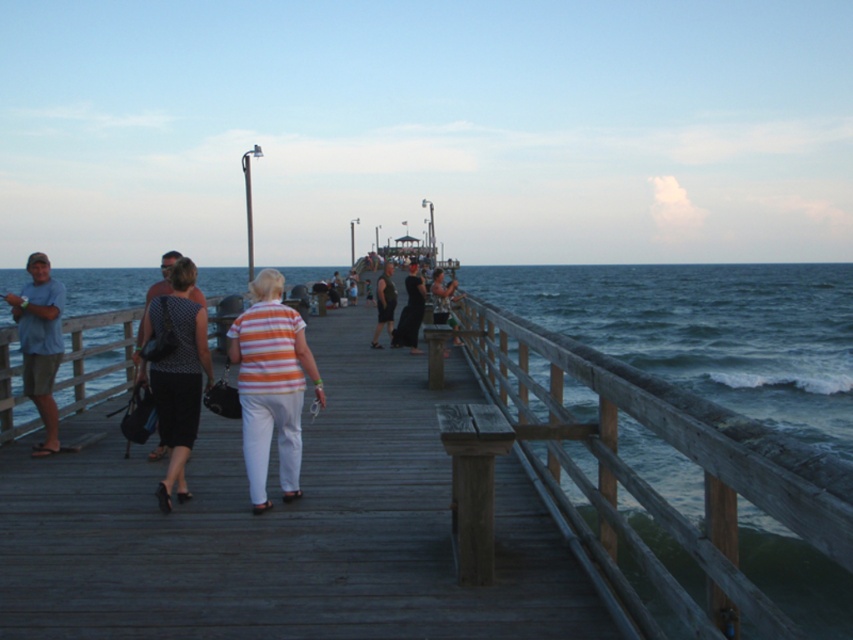
Question: Is striped cotton shirt at center smaller than printed fabric dress at center?

Choices:
 (A) no
 (B) yes

Answer: (B)

Question: Estimate the real-world distances between objects in this image. Which object is closer to the printed fabric dress at center?

Choices:
 (A) striped cotton shirt at center
 (B) dark gray fabric shirt at center
 (C) black dress at center
 (D) matte blue shirt at left

Answer: (A)

Question: Does wooden dock at center lie behind printed fabric dress at center?

Choices:
 (A) no
 (B) yes

Answer: (B)

Question: Does striped cotton shirt at center appear over printed fabric dress at center?

Choices:
 (A) no
 (B) yes

Answer: (A)

Question: Among these objects, which one is nearest to the camera?

Choices:
 (A) dark gray fabric shirt at center
 (B) striped cotton shirt at center
 (C) black dress at center
 (D) matte black dress at center

Answer: (B)

Question: Which object appears closest to the camera in this image?

Choices:
 (A) black dress at center
 (B) printed fabric dress at center
 (C) striped cotton shirt at center
 (D) matte black dress at center

Answer: (B)